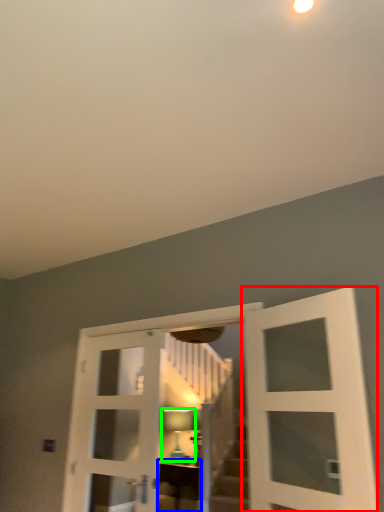
Question: Which is farther away from door (highlighted by a red box)? furniture (highlighted by a blue box) or light fixture (highlighted by a green box)?

Choices:
 (A) furniture
 (B) light fixture

Answer: (B)